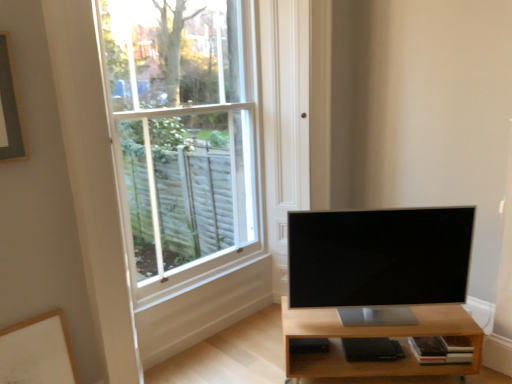
Question: Can you confirm if light brown wood shelf at lower right is shorter than white matte picture frame at lower left?

Choices:
 (A) no
 (B) yes

Answer: (B)

Question: Considering the relative positions of light brown wood shelf at lower right and white matte picture frame at lower left in the image provided, is light brown wood shelf at lower right to the right of white matte picture frame at lower left from the viewer's perspective?

Choices:
 (A) yes
 (B) no

Answer: (A)

Question: Does light brown wood shelf at lower right appear on the left side of white matte picture frame at lower left?

Choices:
 (A) no
 (B) yes

Answer: (A)

Question: Can you see light brown wood shelf at lower right touching white matte picture frame at lower left?

Choices:
 (A) yes
 (B) no

Answer: (B)

Question: Is light brown wood shelf at lower right wider than white matte picture frame at lower left?

Choices:
 (A) no
 (B) yes

Answer: (B)

Question: Considering the positions of satin black tv at center and white glass window at upper left in the image, is satin black tv at center bigger or smaller than white glass window at upper left?

Choices:
 (A) small
 (B) big

Answer: (A)

Question: Considering the relative positions of satin black tv at center and white glass window at upper left in the image provided, is satin black tv at center to the left or to the right of white glass window at upper left?

Choices:
 (A) left
 (B) right

Answer: (B)

Question: From a real-world perspective, is satin black tv at center physically located above or below white glass window at upper left?

Choices:
 (A) above
 (B) below

Answer: (B)

Question: Considering the positions of point (421, 210) and point (208, 119), is point (421, 210) closer or farther from the camera than point (208, 119)?

Choices:
 (A) closer
 (B) farther

Answer: (A)

Question: From their relative heights in the image, would you say satin black tv at center is taller or shorter than light brown wood shelf at lower right?

Choices:
 (A) tall
 (B) short

Answer: (A)

Question: Is satin black tv at center situated inside light brown wood shelf at lower right or outside?

Choices:
 (A) outside
 (B) inside

Answer: (A)

Question: Is satin black tv at center bigger or smaller than light brown wood shelf at lower right?

Choices:
 (A) small
 (B) big

Answer: (A)

Question: From the image's perspective, relative to light brown wood shelf at lower right, is satin black tv at center above or below?

Choices:
 (A) below
 (B) above

Answer: (B)

Question: Considering the positions of light brown wood shelf at lower right and white matte picture frame at lower left in the image, is light brown wood shelf at lower right bigger or smaller than white matte picture frame at lower left?

Choices:
 (A) big
 (B) small

Answer: (A)

Question: Is light brown wood shelf at lower right taller or shorter than white matte picture frame at lower left?

Choices:
 (A) tall
 (B) short

Answer: (B)